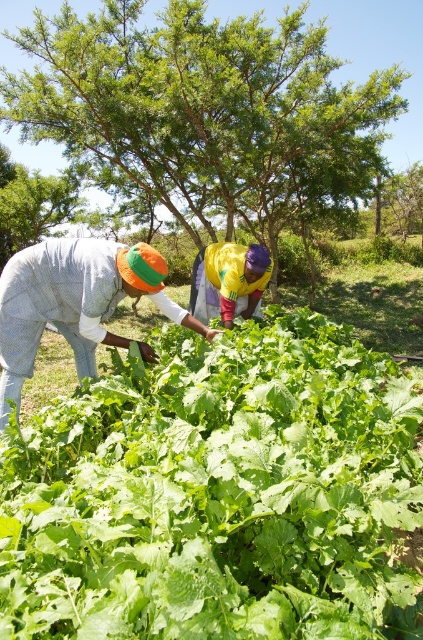
Question: Which of the following is the closest to the observer?

Choices:
 (A) textured cotton shirt at lower left
 (B) yellow fabric at center
 (C) green leafy vegetable at center

Answer: (C)

Question: Is textured cotton shirt at lower left positioned at the back of yellow fabric at center?

Choices:
 (A) no
 (B) yes

Answer: (A)

Question: Which of the following is the farthest from the observer?

Choices:
 (A) (10, 360)
 (B) (227, 477)
 (C) (236, 273)

Answer: (C)

Question: Which point is closer to the camera?

Choices:
 (A) (225, 241)
 (B) (271, 561)
 (C) (93, 330)

Answer: (B)

Question: In this image, where is green leafy vegetable at center located relative to textured cotton shirt at lower left?

Choices:
 (A) above
 (B) below

Answer: (B)

Question: Where is green leafy vegetable at center located in relation to yellow fabric at center in the image?

Choices:
 (A) above
 (B) below

Answer: (B)